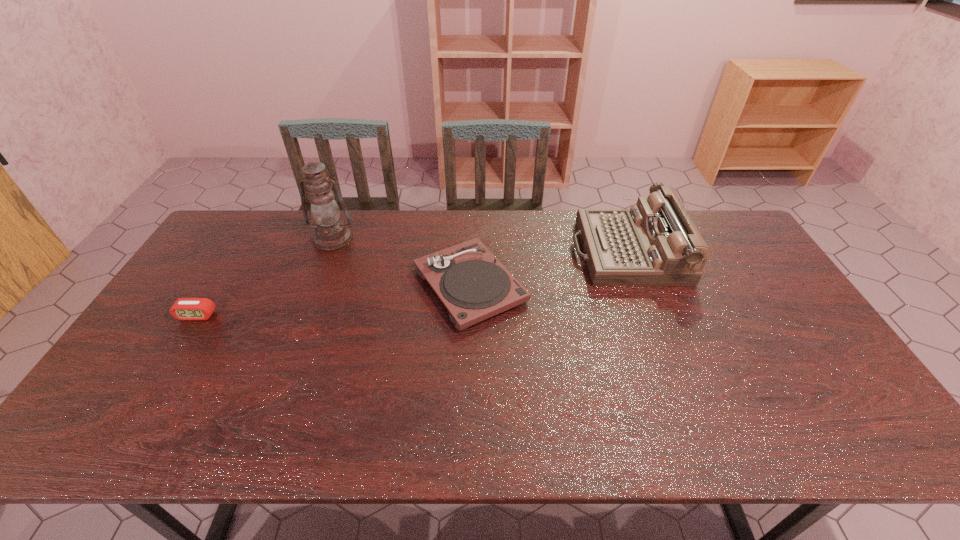
I want to click on vacant area located 0.240m on the keyboard of the third shortest object, so click(x=501, y=251).

The image size is (960, 540). I want to click on free space located on the keyboard of the third shortest object, so click(495, 251).

What are the coordinates of `free region located on the right of the second shortest object` in the screenshot? It's located at (570, 285).

In order to click on free region located on the front-facing side of the alarm clock in this screenshot , I will do `click(176, 349)`.

The height and width of the screenshot is (540, 960). I want to click on oil lamp present at the far edge, so click(331, 233).

This screenshot has width=960, height=540. I want to click on typewriter located at the far edge, so click(654, 243).

At what (x,y) coordinates should I click in order to perform the action: click on phonograph_record that is at the far edge. Please return your answer as a coordinate pair (x, y). Looking at the image, I should click on (471, 282).

Locate an element on the screen. The width and height of the screenshot is (960, 540). object located at the left edge is located at coordinates (183, 308).

Image resolution: width=960 pixels, height=540 pixels. In the image, there is a desktop. Find the location of `vacant space at the far edge`. vacant space at the far edge is located at coordinates (287, 239).

Where is `free space at the near edge of the desktop`? The width and height of the screenshot is (960, 540). free space at the near edge of the desktop is located at coordinates (287, 435).